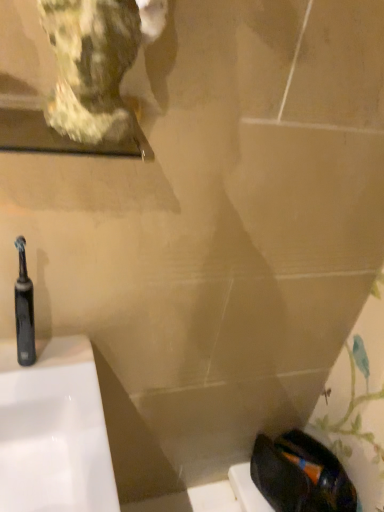
Question: Is black rubber toothbrush at left turned away from marble statue at upper left?

Choices:
 (A) no
 (B) yes

Answer: (A)

Question: Does black rubber toothbrush at left have a larger size compared to marble statue at upper left?

Choices:
 (A) yes
 (B) no

Answer: (B)

Question: Could marble statue at upper left be considered to be inside black rubber toothbrush at left?

Choices:
 (A) yes
 (B) no

Answer: (B)

Question: Does black rubber toothbrush at left have a lesser width compared to marble statue at upper left?

Choices:
 (A) no
 (B) yes

Answer: (B)

Question: Is black rubber toothbrush at left next to marble statue at upper left and touching it?

Choices:
 (A) yes
 (B) no

Answer: (B)

Question: Does black rubber toothbrush at left appear on the left side of marble statue at upper left?

Choices:
 (A) yes
 (B) no

Answer: (A)

Question: Are marble statue at upper left and black rubber toothbrush at left making contact?

Choices:
 (A) no
 (B) yes

Answer: (A)

Question: Can you confirm if marble statue at upper left is taller than black rubber toothbrush at left?

Choices:
 (A) no
 (B) yes

Answer: (A)

Question: From a real-world perspective, is marble statue at upper left located beneath black rubber toothbrush at left?

Choices:
 (A) yes
 (B) no

Answer: (B)

Question: Is marble statue at upper left not near black rubber toothbrush at left?

Choices:
 (A) yes
 (B) no

Answer: (B)

Question: Is marble statue at upper left positioned beyond the bounds of black rubber toothbrush at left?

Choices:
 (A) no
 (B) yes

Answer: (B)

Question: Is the position of marble statue at upper left less distant than that of black rubber toothbrush at left?

Choices:
 (A) no
 (B) yes

Answer: (B)

Question: Based on their sizes in the image, would you say black rubber toothbrush at left is bigger or smaller than marble statue at upper left?

Choices:
 (A) big
 (B) small

Answer: (B)